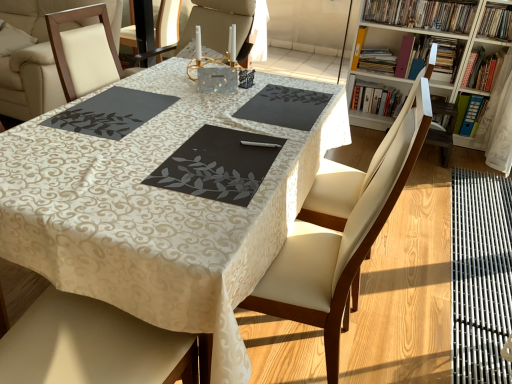
Locate an element on the screen. vacant area on top of matte black placemat at center (from a real-world perspective) is located at coordinates (186, 143).